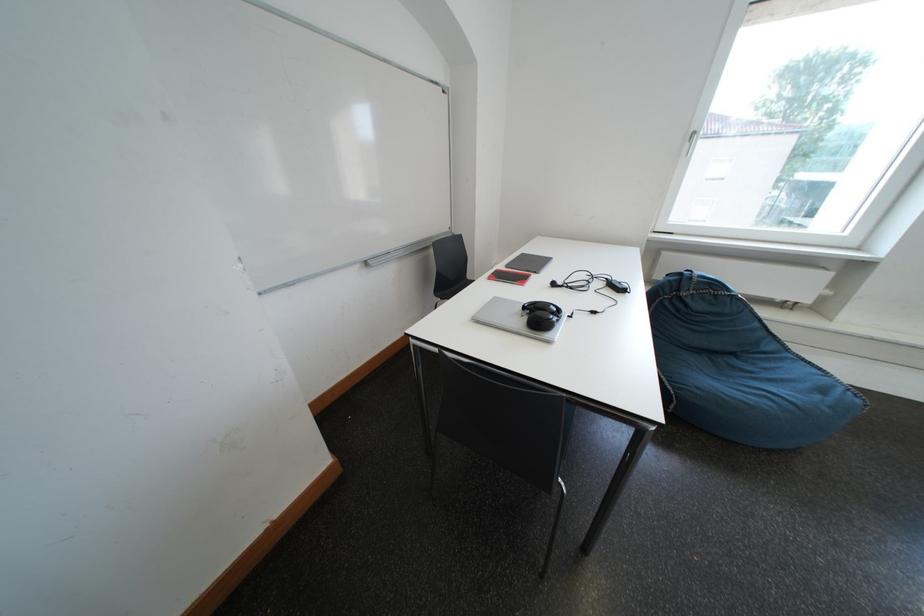
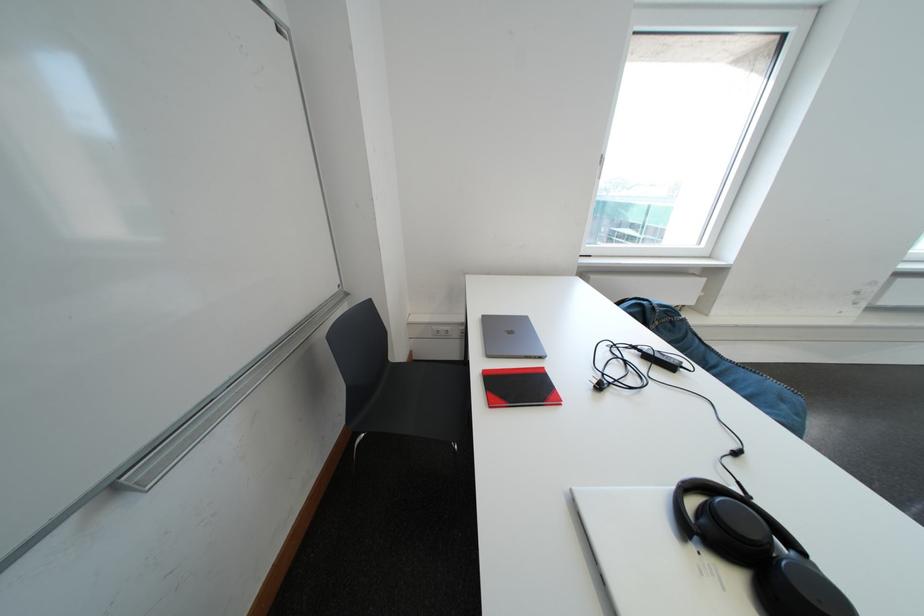
Question: The first image is from the beginning of the video and the second image is from the end. How did the camera likely rotate when shooting the video?

Choices:
 (A) Left
 (B) Right
 (C) Up
 (D) Down

Answer: (B)